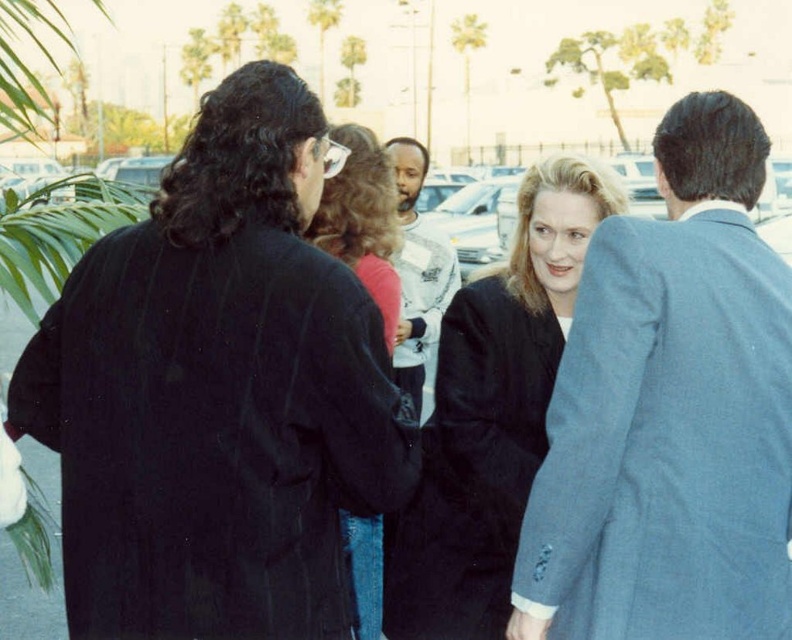
Can you confirm if blue textured suit at right is positioned to the right of white cotton shirt at center?

Correct, you'll find blue textured suit at right to the right of white cotton shirt at center.

Who is positioned more to the right, blue textured suit at right or white cotton shirt at center?

Positioned to the right is blue textured suit at right.

Who is more distant from viewer, (x=671, y=282) or (x=417, y=150)?

Point (x=417, y=150)

Identify the location of blue textured suit at right. pos(669,413).

Can you confirm if black pinstripe suit at left is positioned to the right of white cotton shirt at center?

No, black pinstripe suit at left is not to the right of white cotton shirt at center.

What are the coordinates of `black pinstripe suit at left` in the screenshot? It's located at (216, 392).

Does blue textured suit at right have a lesser height compared to matte black coat at center?

A: Correct, blue textured suit at right is not as tall as matte black coat at center.

Between point (775, 632) and point (499, 339), which one is positioned in front?

Positioned in front is point (775, 632).

Between point (737, 346) and point (448, 435), which one is positioned behind?

The point (448, 435) is more distant.

At what (x,y) coordinates should I click in order to perform the action: click on blue textured suit at right. Please return your answer as a coordinate pair (x, y). The height and width of the screenshot is (640, 792). Looking at the image, I should click on (669, 413).